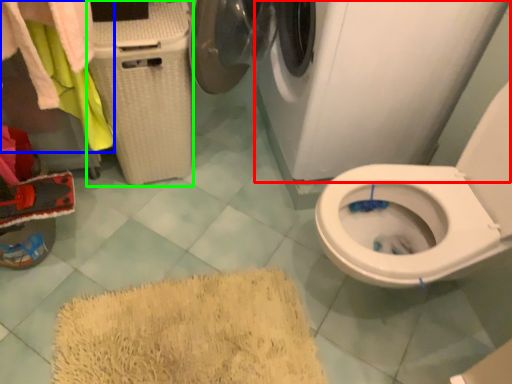
Question: Based on their relative distances, which object is nearer to washing machine (highlighted by a red box)? Choose from laundry (highlighted by a blue box) and laundry basket (highlighted by a green box).

Choices:
 (A) laundry
 (B) laundry basket

Answer: (B)